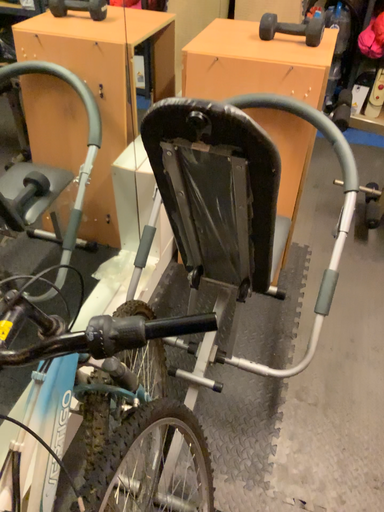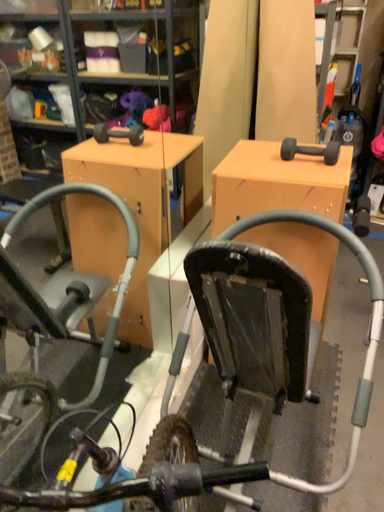
Question: Which way did the camera rotate in the video?

Choices:
 (A) rotated downward
 (B) rotated upward

Answer: (B)